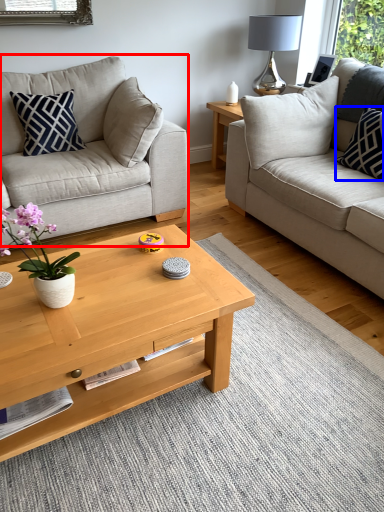
Question: Which point is further to the camera, studio couch (highlighted by a red box) or pillow (highlighted by a blue box)?

Choices:
 (A) studio couch
 (B) pillow

Answer: (B)